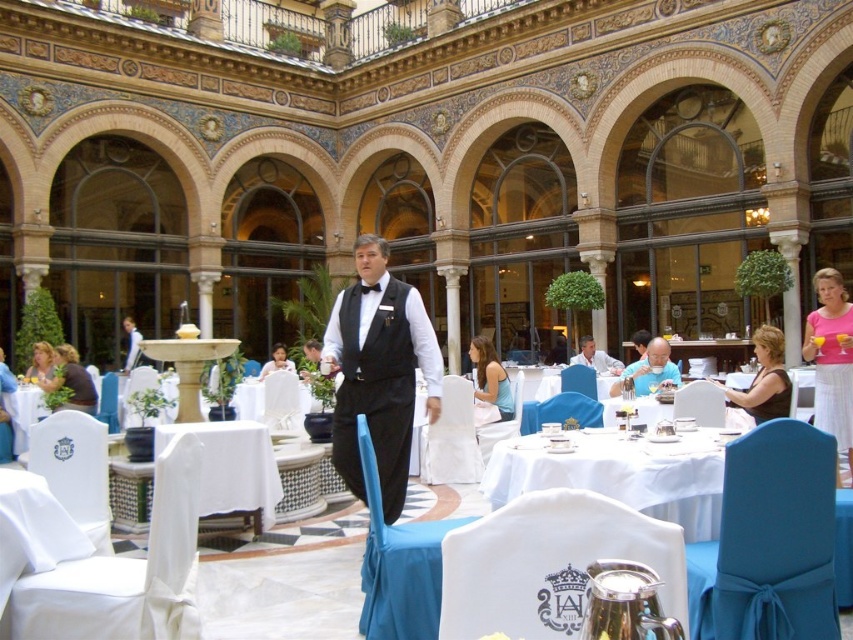
Does black satin vest at center appear under black satin bow tie at center?

No.

From the picture: Is black satin vest at center above black satin bow tie at center?

Correct, black satin vest at center is located above black satin bow tie at center.

Who is more distant from viewer, (415, 291) or (596, 365)?

The point (596, 365) is more distant.

In order to click on black satin vest at center in this screenshot , I will do `click(379, 371)`.

Which is in front, point (380, 301) or point (724, 392)?

Point (380, 301) is more forward.

From the picture: Who is shorter, black satin vest at center or black fabric dress at lower right?

black fabric dress at lower right

Which is in front, point (372, 272) or point (767, 376)?

Positioned in front is point (767, 376).

At what (x,y) coordinates should I click in order to perform the action: click on black satin vest at center. Please return your answer as a coordinate pair (x, y). Image resolution: width=853 pixels, height=640 pixels. Looking at the image, I should click on (379, 371).

Does black satin bow tie at center appear over white fabric shirt at center?

Indeed, black satin bow tie at center is positioned over white fabric shirt at center.

Does black satin bow tie at center have a smaller size compared to white fabric shirt at center?

Correct, black satin bow tie at center occupies less space than white fabric shirt at center.

I want to click on black satin bow tie at center, so [x=595, y=356].

What are the coordinates of `black satin bow tie at center` in the screenshot? It's located at (595, 356).